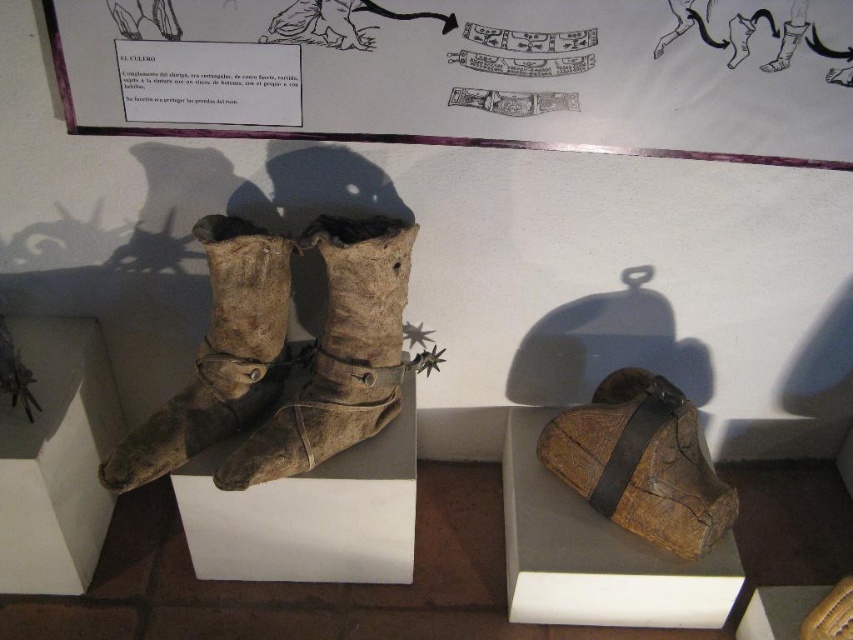
Is white paper bulletin board at upper center positioned at the back of brown leather boots at center?

That is False.

Can you confirm if white paper bulletin board at upper center is positioned below brown leather boots at center?

No, white paper bulletin board at upper center is not below brown leather boots at center.

This screenshot has width=853, height=640. Find the location of `white paper bulletin board at upper center`. white paper bulletin board at upper center is located at coordinates (469, 72).

Which is below, brown leather boots at center or worn leather boots at center?

brown leather boots at center is lower down.

Can you confirm if brown leather boots at center is thinner than worn leather boots at center?

No, brown leather boots at center is not thinner than worn leather boots at center.

Is point (241, 577) positioned before point (395, 244)?

No, (241, 577) is further to viewer.

Identify the location of brown leather boots at center. (309, 513).

Is brown leather box at lower left above brown leather boot at center?

Incorrect, brown leather box at lower left is not positioned above brown leather boot at center.

Is point (6, 429) closer to camera compared to point (262, 275)?

No, (6, 429) is further to viewer.

This screenshot has width=853, height=640. In order to click on brown leather box at lower left in this screenshot , I will do `click(56, 458)`.